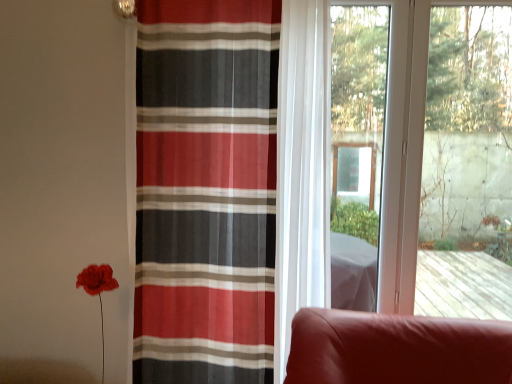
Question: From the image's perspective, is transparent glass window at center under striped sheer curtain at center?

Choices:
 (A) no
 (B) yes

Answer: (A)

Question: Is the depth of transparent glass window at center greater than that of striped sheer curtain at center?

Choices:
 (A) no
 (B) yes

Answer: (B)

Question: Is transparent glass window at center positioned before striped sheer curtain at center?

Choices:
 (A) no
 (B) yes

Answer: (A)

Question: Is striped sheer curtain at center a part of transparent glass window at center?

Choices:
 (A) yes
 (B) no

Answer: (B)

Question: Is transparent glass window at center placed right next to striped sheer curtain at center?

Choices:
 (A) yes
 (B) no

Answer: (B)

Question: From a real-world perspective, is transparent glass window at center under striped sheer curtain at center?

Choices:
 (A) no
 (B) yes

Answer: (A)

Question: Is striped sheer curtain at center smaller than transparent glass window at center?

Choices:
 (A) no
 (B) yes

Answer: (A)

Question: Considering the relative sizes of striped sheer curtain at center and transparent glass window at center in the image provided, is striped sheer curtain at center shorter than transparent glass window at center?

Choices:
 (A) yes
 (B) no

Answer: (B)

Question: Is striped sheer curtain at center turned away from transparent glass window at center?

Choices:
 (A) no
 (B) yes

Answer: (A)

Question: From the image's perspective, is striped sheer curtain at center above transparent glass window at center?

Choices:
 (A) yes
 (B) no

Answer: (B)

Question: Is striped sheer curtain at center behind transparent glass window at center?

Choices:
 (A) yes
 (B) no

Answer: (B)

Question: Is striped sheer curtain at center bigger than transparent glass window at center?

Choices:
 (A) no
 (B) yes

Answer: (B)

Question: From the image's perspective, is transparent glass window at center positioned above or below striped sheer curtain at center?

Choices:
 (A) below
 (B) above

Answer: (B)